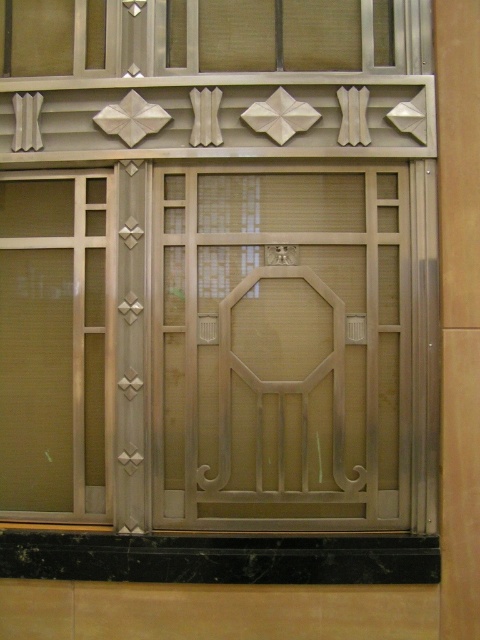
Question: Is matte gold screen door at center closer to the viewer compared to brushed metal window at upper center?

Choices:
 (A) no
 (B) yes

Answer: (B)

Question: Which point is farther to the camera?

Choices:
 (A) (85, 68)
 (B) (248, 378)

Answer: (A)

Question: Which point appears closest to the camera in this image?

Choices:
 (A) (289, 29)
 (B) (262, 506)

Answer: (B)

Question: Can you confirm if matte gold screen door at center is thinner than brushed metal window at upper center?

Choices:
 (A) no
 (B) yes

Answer: (B)

Question: Is matte gold screen door at center further to camera compared to brushed metal window at upper center?

Choices:
 (A) yes
 (B) no

Answer: (B)

Question: Which of the following is the closest to the observer?

Choices:
 (A) (332, 10)
 (B) (331, 516)

Answer: (B)